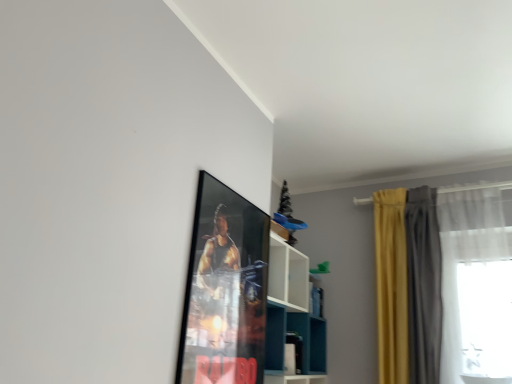
Question: Does metallic poster at upper center touch yellow fabric curtain at right, the third curtain viewed from the right?

Choices:
 (A) yes
 (B) no

Answer: (B)

Question: Is metallic poster at upper center aimed at yellow fabric curtain at right, positioned as the first curtain in left-to-right order?

Choices:
 (A) yes
 (B) no

Answer: (B)

Question: Does metallic poster at upper center appear on the left side of yellow fabric curtain at right, the third curtain viewed from the right?

Choices:
 (A) yes
 (B) no

Answer: (A)

Question: Does metallic poster at upper center have a smaller size compared to yellow fabric curtain at right, the third curtain viewed from the right?

Choices:
 (A) yes
 (B) no

Answer: (A)

Question: From a real-world perspective, is metallic poster at upper center located higher than yellow fabric curtain at right, positioned as the first curtain in left-to-right order?

Choices:
 (A) no
 (B) yes

Answer: (A)

Question: Would you say white sheer curtain at right, marked as the 3th curtain in a left-to-right arrangement, is inside or outside metallic poster at upper center?

Choices:
 (A) outside
 (B) inside

Answer: (A)

Question: From a real-world perspective, is white sheer curtain at right, marked as the 3th curtain in a left-to-right arrangement, positioned above or below metallic poster at upper center?

Choices:
 (A) below
 (B) above

Answer: (B)

Question: In terms of size, does white sheer curtain at right, which ranks as the first curtain in right-to-left order, appear bigger or smaller than metallic poster at upper center?

Choices:
 (A) small
 (B) big

Answer: (B)

Question: Is point (389, 324) closer or farther from the camera than point (215, 206)?

Choices:
 (A) closer
 (B) farther

Answer: (B)

Question: Is yellow velvet curtains at right, which is counted as the second curtain, starting from the left, wider or thinner than metallic poster at upper center?

Choices:
 (A) thin
 (B) wide

Answer: (B)

Question: Considering the positions of yellow velvet curtains at right, which is the second curtain from right to left, and metallic poster at upper center in the image, is yellow velvet curtains at right, which is the second curtain from right to left, bigger or smaller than metallic poster at upper center?

Choices:
 (A) small
 (B) big

Answer: (B)

Question: Do you think yellow velvet curtains at right, which is counted as the second curtain, starting from the left, is within metallic poster at upper center, or outside of it?

Choices:
 (A) outside
 (B) inside

Answer: (A)

Question: Considering the positions of point (411, 218) and point (224, 218), is point (411, 218) closer or farther from the camera than point (224, 218)?

Choices:
 (A) closer
 (B) farther

Answer: (B)

Question: In terms of size, does yellow fabric curtain at right, positioned as the first curtain in left-to-right order, appear bigger or smaller than white sheer curtain at right, marked as the 3th curtain in a left-to-right arrangement?

Choices:
 (A) big
 (B) small

Answer: (B)

Question: Does point (391, 342) appear closer or farther from the camera than point (388, 210)?

Choices:
 (A) farther
 (B) closer

Answer: (B)